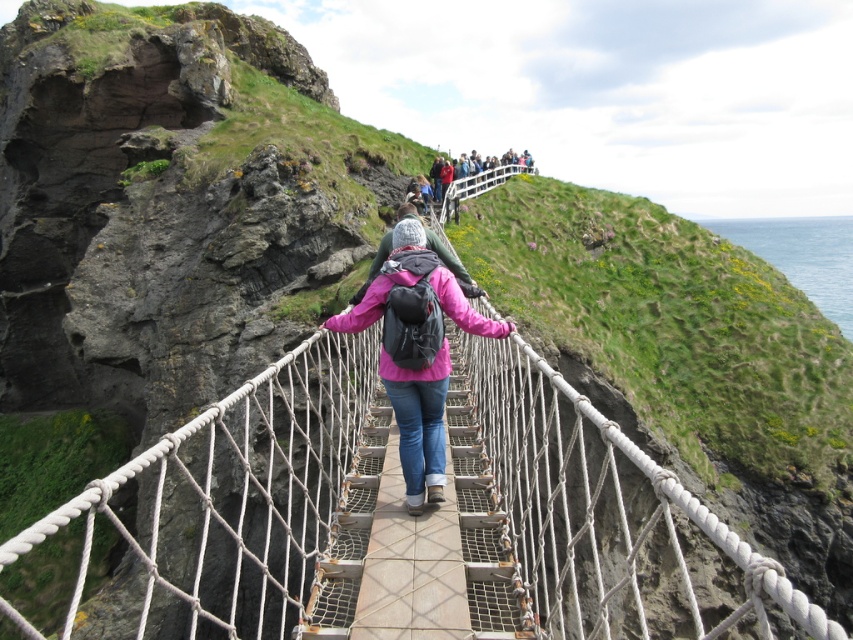
What are the coordinates of `matte pink jacket at center` in the screenshot? It's located at (415, 289).

Can you confirm if matte pink jacket at center is positioned above matte black backpack at upper center?

No, matte pink jacket at center is not above matte black backpack at upper center.

I want to click on matte pink jacket at center, so click(415, 289).

Which is below, green grassy at upper center or wooden planks at center?

wooden planks at center is lower down.

Between green grassy at upper center and wooden planks at center, which one has more height?

Standing taller between the two is green grassy at upper center.

Who is more distant from viewer, (786, 330) or (421, 625)?

Point (786, 330)

In order to click on green grassy at upper center in this screenshot , I will do `click(671, 324)`.

Is matte pink jacket at center to the right of wooden planks at center from the viewer's perspective?

Indeed, matte pink jacket at center is positioned on the right side of wooden planks at center.

Does point (421, 390) lie behind point (433, 534)?

Yes, it is behind point (433, 534).

Image resolution: width=853 pixels, height=640 pixels. In order to click on matte pink jacket at center in this screenshot , I will do `click(415, 289)`.